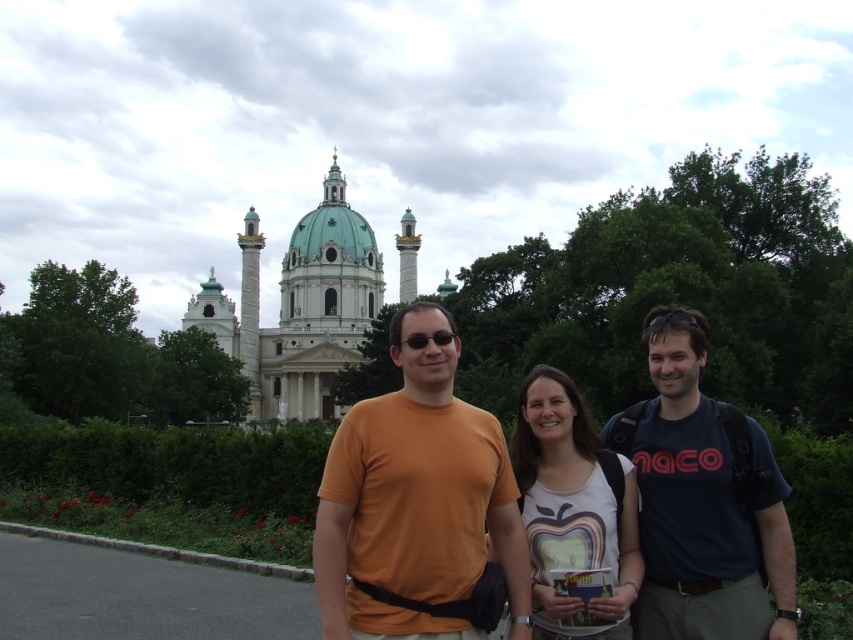
Question: Based on their relative distances, which object is farther from the orange t-shirt at center?

Choices:
 (A) matte black sunglasses at center
 (B) dark blue t-shirt at center
 (C) white matte t-shirt at center
 (D) white marble palace at upper center

Answer: (D)

Question: Does white matte t-shirt at center appear on the right side of matte black sunglasses at center?

Choices:
 (A) no
 (B) yes

Answer: (B)

Question: Does dark blue t-shirt at center appear on the right side of white matte t-shirt at center?

Choices:
 (A) no
 (B) yes

Answer: (B)

Question: Which object is positioned closest to the matte black sunglasses at center?

Choices:
 (A) orange cotton shirt at center
 (B) white matte t-shirt at center
 (C) dark blue t-shirt at center

Answer: (A)

Question: Which point is closer to the camera?

Choices:
 (A) matte black sunglasses at center
 (B) white marble palace at upper center
 (C) orange t-shirt at center
 (D) orange cotton shirt at center

Answer: (C)

Question: Where is white marble palace at upper center located in relation to matte black sunglasses at center in the image?

Choices:
 (A) right
 (B) left

Answer: (B)